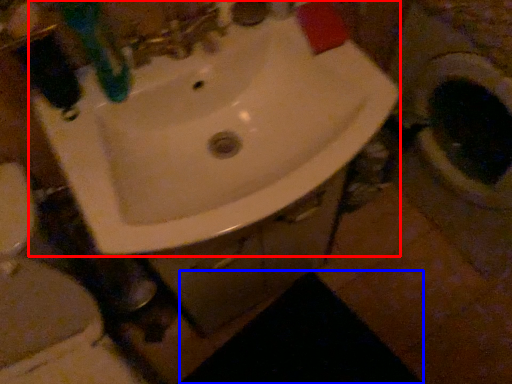
Question: Which of the following is the closest to the observer, sink (highlighted by a red box) or dark (highlighted by a blue box)?

Choices:
 (A) sink
 (B) dark

Answer: (A)